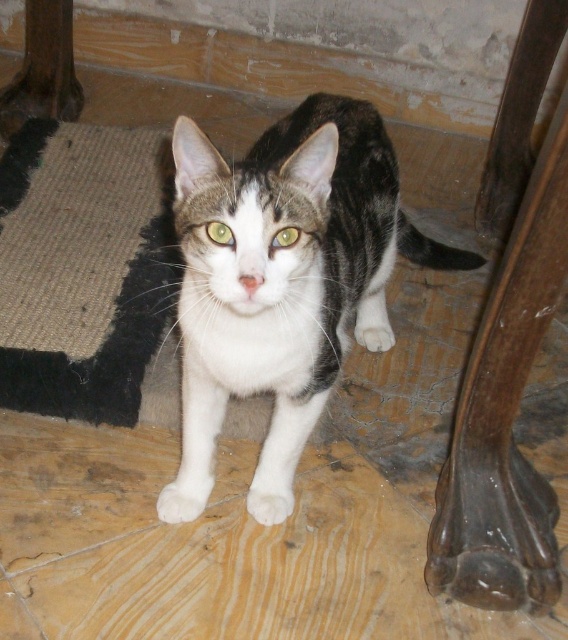
Looking at this image, is white fur cat at center below sisal carpet at lower left?

Yes, white fur cat at center is below sisal carpet at lower left.

Between point (269, 424) and point (139, 321), which one is positioned behind?

Point (139, 321)

What do you see at coordinates (282, 282) in the screenshot? I see `white fur cat at center` at bounding box center [282, 282].

Find the location of a particular element. This screenshot has height=640, width=568. white fur cat at center is located at coordinates (282, 282).